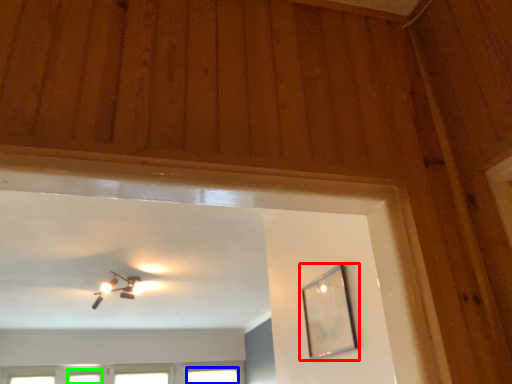
Question: Considering the real-world distances, which object is farthest from picture frame (highlighted by a red box)? window (highlighted by a blue box) or window (highlighted by a green box)?

Choices:
 (A) window
 (B) window

Answer: (B)